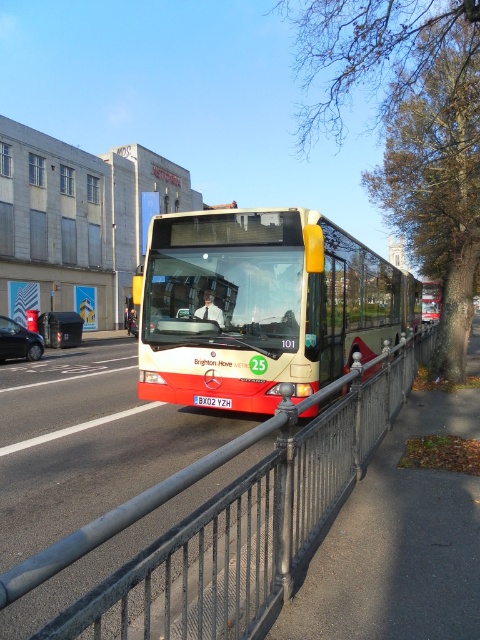
You are standing on the sidewalk next to the shiny black car at left. You need to cross the street to reach the bus stop located 100 feet ahead. The bus is moving towards you. Can you safely cross the street before the bus arrives?

The shiny black car at left is 55.89 feet away from viewer. Since the bus is moving towards you and the distance between you and the bus is not provided, it is impossible to determine if you can safely cross before the bus arrives.

You are a pedestrian standing on the sidewalk and want to cross the street where the metallic gray fence at center and the shiny black car at left are located. Which object is shorter, allowing you to see over it while waiting to cross?

The metallic gray fence at center is not as tall as the shiny black car at left, so you can see over the metallic gray fence at center while waiting to cross the street.

You are a pedestrian standing on the sidewalk and see the shiny black car at left and the red matte bus at center. Which vehicle is closer to the left side of the road?

The shiny black car at left is positioned on the left side of the red matte bus at center, so it is closer to the left side of the road.